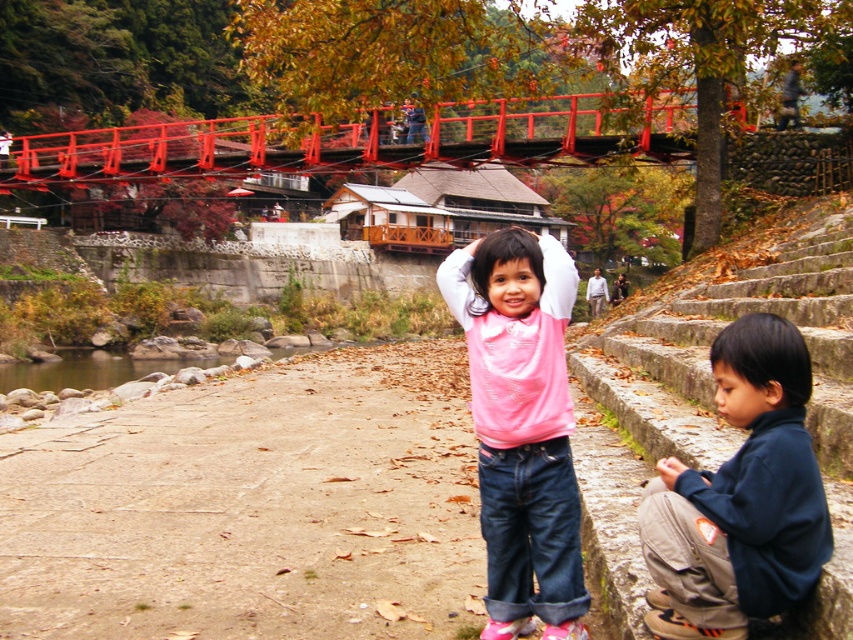
Does dark blue fleece jacket at lower right appear over metallic red bridge at upper center?

No.

Is dark blue fleece jacket at lower right taller than metallic red bridge at upper center?

No.

Who is more forward, (x=682, y=550) or (x=477, y=157)?

Positioned in front is point (x=682, y=550).

Find the location of `dark blue fleece jacket at lower right`. dark blue fleece jacket at lower right is located at coordinates (740, 497).

Does dark blue fleece jacket at lower right appear on the left side of pink matte shirt at center?

In fact, dark blue fleece jacket at lower right is to the right of pink matte shirt at center.

Who is more forward, (741, 412) or (550, 374)?

Point (741, 412)

Where is `dark blue fleece jacket at lower right`? dark blue fleece jacket at lower right is located at coordinates (740, 497).

Does pink matte shirt at center appear on the left side of metallic red bridge at upper center?

Incorrect, pink matte shirt at center is not on the left side of metallic red bridge at upper center.

Is pink matte shirt at center to the right of metallic red bridge at upper center from the viewer's perspective?

Indeed, pink matte shirt at center is positioned on the right side of metallic red bridge at upper center.

Is point (520, 264) positioned before point (367, 118)?

That is True.

At what (x,y) coordinates should I click in order to perform the action: click on pink matte shirt at center. Please return your answer as a coordinate pair (x, y). Looking at the image, I should click on (521, 426).